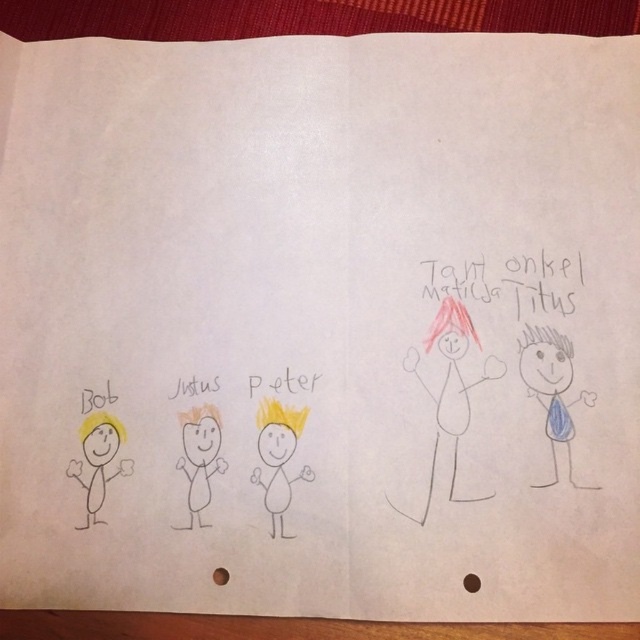
What is the 2D coordinate of the handwritten text at upper right?

The handwritten text at upper right is located at point (509,282).

You are a teacher reviewing a student drawing. The drawing has the handwritten text at upper right and the yellow paper at left. Which object is closer to the top edge of the paper?

The handwritten text at upper right is closer to the top edge of the paper because it is positioned over the yellow paper at left.